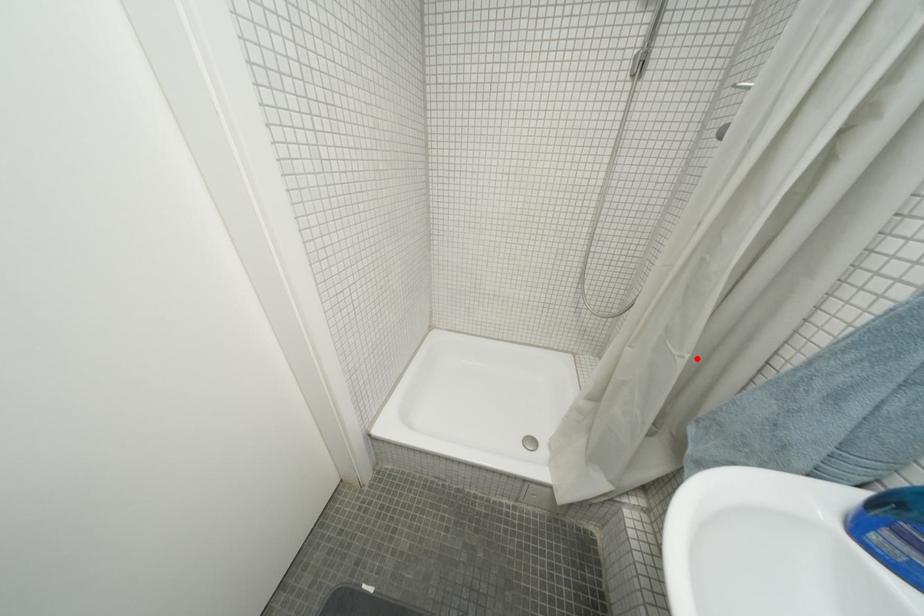
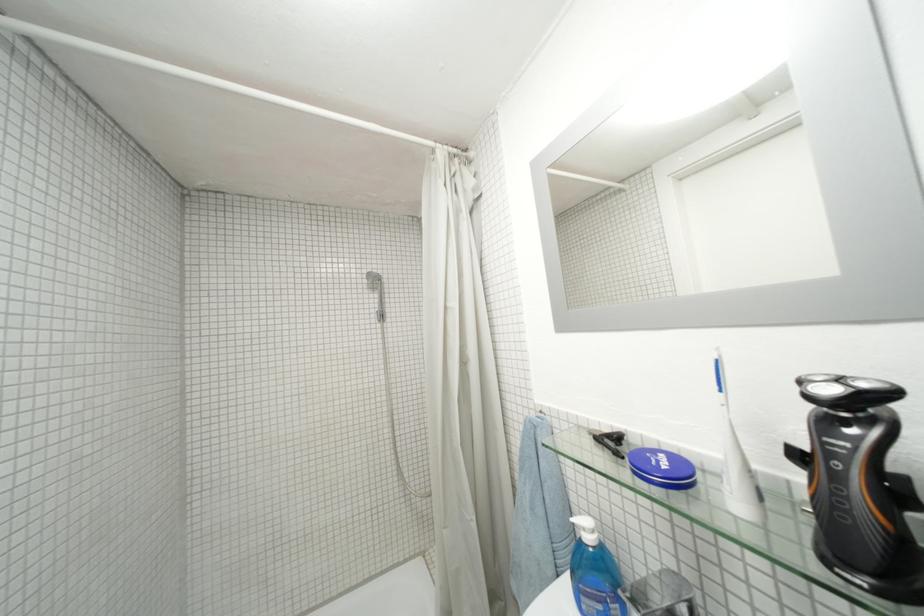
The point at the highlighted location is marked in the first image. Where is the corresponding point in the second image?

(482, 521)